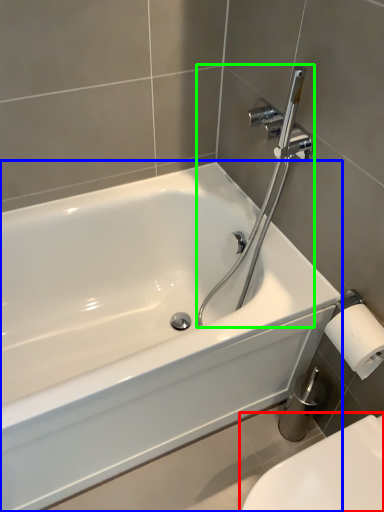
Question: Which object is the closest to the toilet (highlighted by a red box)? Choose among these: bathtub (highlighted by a blue box) or plumbing fixture (highlighted by a green box).

Choices:
 (A) bathtub
 (B) plumbing fixture

Answer: (A)